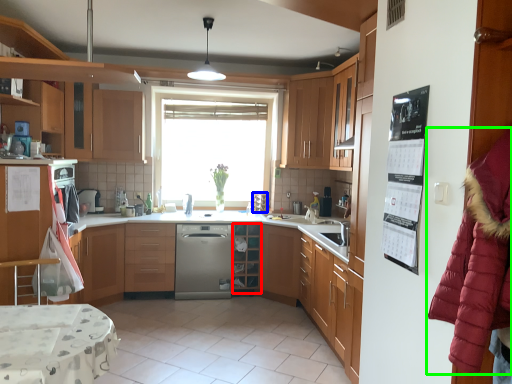
Question: Estimate the real-world distances between objects in this image. Which object is closer to shelf (highlighted by a red box), appliance (highlighted by a blue box) or fur coat (highlighted by a green box)?

Choices:
 (A) appliance
 (B) fur coat

Answer: (A)